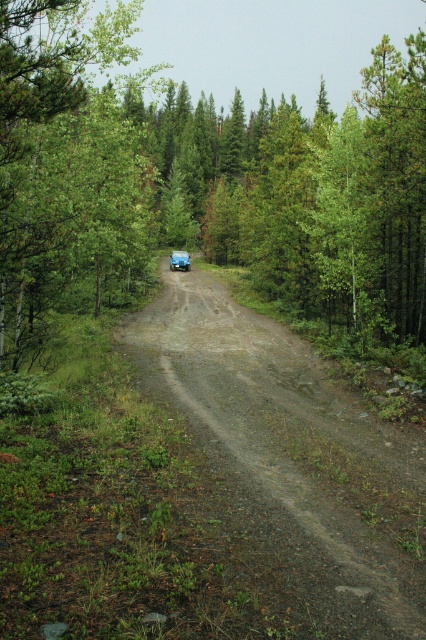
You are standing at the edge of the dirt road and see the green leafy tree at center and the green matte jeep at center. Which object is taller?

The green leafy tree at center is much taller than the green matte jeep at center.

You are driving a green matte jeep at center along a narrow dirt road through a dense forest. You need to pass a green leafy tree at center. Which side should you steer to avoid hitting the tree?

The green leafy tree at center is to the right of the green matte jeep at center, so you should steer to the left to avoid hitting the tree.

You are standing at the starting point of the narrow dirt road in the forest. You see two points marked on the road ahead. The first point is at coordinates point (362, 273), and the second point is at point (114, 182). Which point is closer to you as you stand at the starting point?

Point (362, 273) is closer to the camera than point (114, 182), so the first point is closer to you.